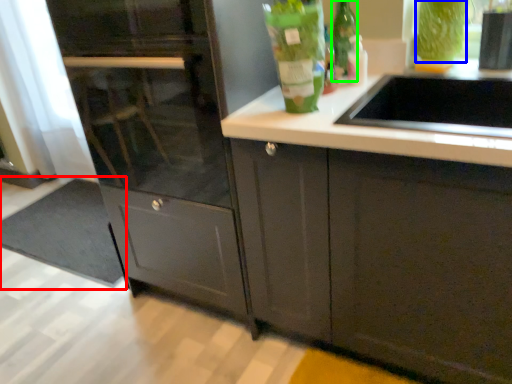
Question: Estimate the real-world distances between objects in this image. Which object is closer to doormat (highlighted by a red box), drink (highlighted by a blue box) or glass bottle (highlighted by a green box)?

Choices:
 (A) drink
 (B) glass bottle

Answer: (B)